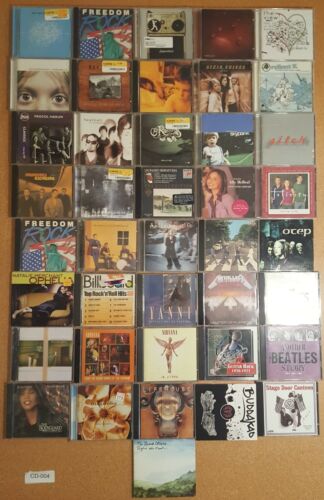
Image resolution: width=324 pixels, height=500 pixels. What are the coordinates of `cds` in the screenshot? It's located at (176, 293).